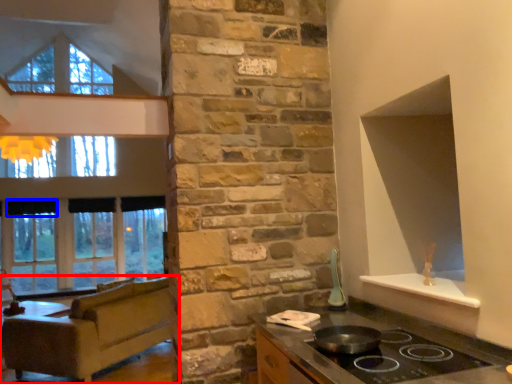
Question: Which of the following is the farthest to the observer, studio couch (highlighted by a red box) or curtain (highlighted by a blue box)?

Choices:
 (A) studio couch
 (B) curtain

Answer: (B)